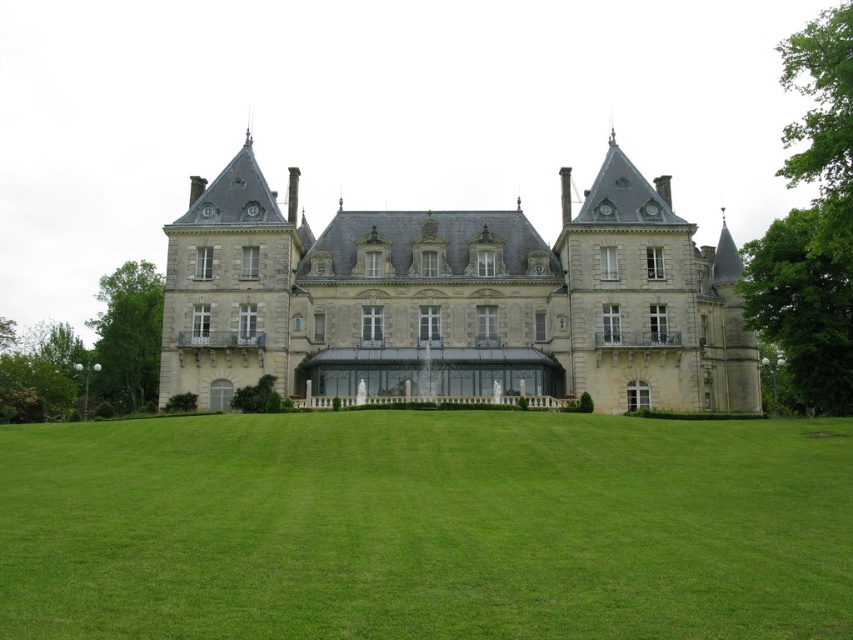
Question: Which object appears closest to the camera in this image?

Choices:
 (A) gray stone castle at center
 (B) green grass at center

Answer: (B)

Question: Is green grass at center above gray stone castle at center?

Choices:
 (A) no
 (B) yes

Answer: (A)

Question: Which point is farther to the camera?

Choices:
 (A) click(270, 579)
 (B) click(265, 336)

Answer: (B)

Question: Which point is farther from the camera taking this photo?

Choices:
 (A) click(509, 532)
 (B) click(631, 243)

Answer: (B)

Question: Can you confirm if green grass at center is bigger than gray stone castle at center?

Choices:
 (A) no
 (B) yes

Answer: (A)

Question: Does green grass at center have a greater width compared to gray stone castle at center?

Choices:
 (A) no
 (B) yes

Answer: (B)